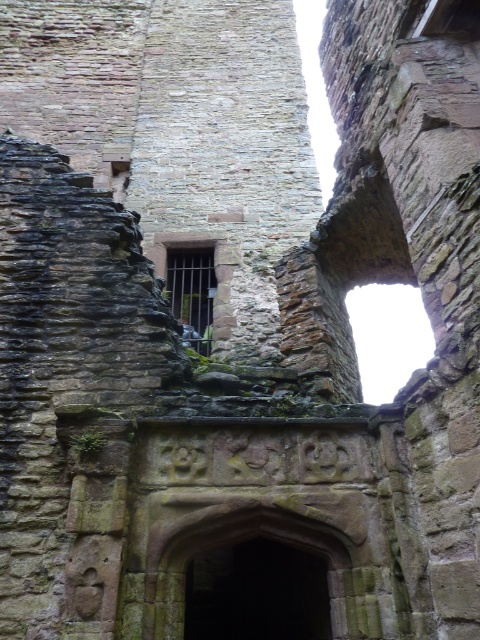
You are an archaeologist examining the ancient stone structure. You notice a rustic stone archway at center and a dark brown wooden window at center. Which object is positioned to the right of the other?

The rustic stone archway at center is to the right of the dark brown wooden window at center.

You are standing in front of an ancient stone structure with two points marked on it. The first point is at coordinates point (345,572) and the second is at point (214,280). Which of these points is nearer to your current position?

Point (345,572) is closer to the camera than point (214,280), so the first point is nearer to your current position.